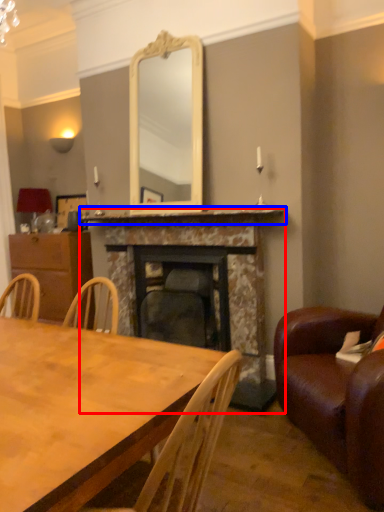
Question: Which object appears closest to the camera in this image, fireplace (highlighted by a red box) or mantle (highlighted by a blue box)?

Choices:
 (A) fireplace
 (B) mantle

Answer: (B)